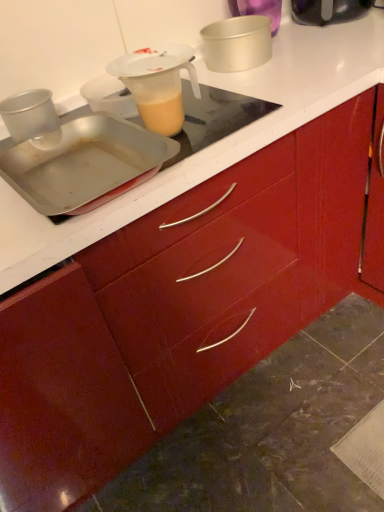
Identify the location of vacant area that lies in front of black plastic toaster at upper right, which is the 4th kitchen appliance in bottom-to-top order. This screenshot has width=384, height=512. (357, 37).